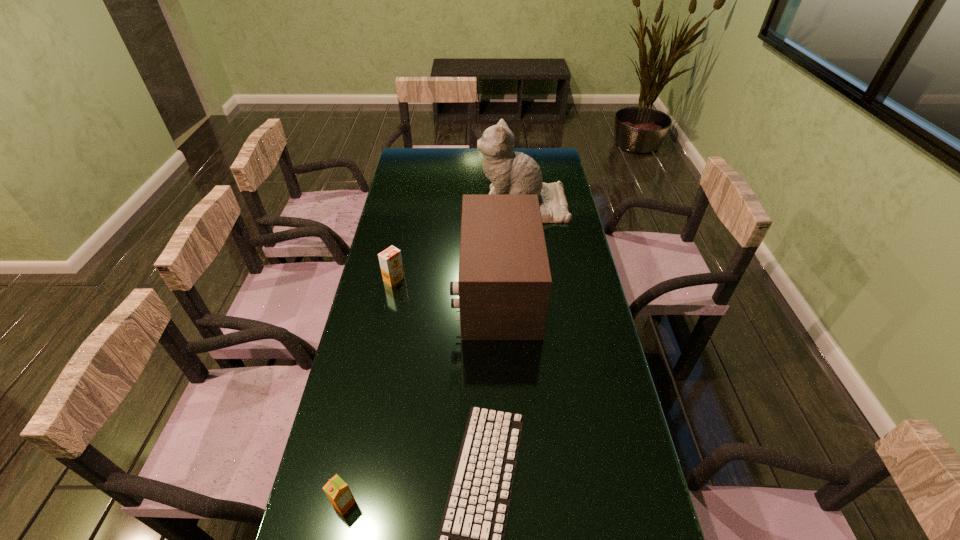
Where is `the tallest object`? the tallest object is located at coordinates (512, 173).

The width and height of the screenshot is (960, 540). Identify the location of the farthest object. (512, 173).

You are a GUI agent. You are given a task and a screenshot of the screen. Output one action in this format:
    pyautogui.click(x=<x>, y=<y>)
    Task: Click on the fourth shortest object
    
    Given the screenshot: What is the action you would take?
    pyautogui.click(x=504, y=284)

The height and width of the screenshot is (540, 960). What are the coordinates of `the third shortest object` in the screenshot? It's located at (390, 259).

I want to click on the farther orange juice, so click(390, 259).

The height and width of the screenshot is (540, 960). Identify the location of the second shortest object. (338, 492).

You are a GUI agent. You are given a task and a screenshot of the screen. Output one action in this format:
    pyautogui.click(x=<x>, y=<y>)
    Task: Click on the shorter orange juice
    Image resolution: width=960 pixels, height=540 pixels.
    Given the screenshot: What is the action you would take?
    pyautogui.click(x=338, y=492)

Locate an element on the screen. vacant region located on the front-facing side of the farthest object is located at coordinates (442, 206).

Identify the location of vacant space situated on the front-facing side of the farthest object. The height and width of the screenshot is (540, 960). (418, 206).

Where is `vacant space situated 0.360m on the front-facing side of the farthest object`? The image size is (960, 540). vacant space situated 0.360m on the front-facing side of the farthest object is located at coordinates (391, 206).